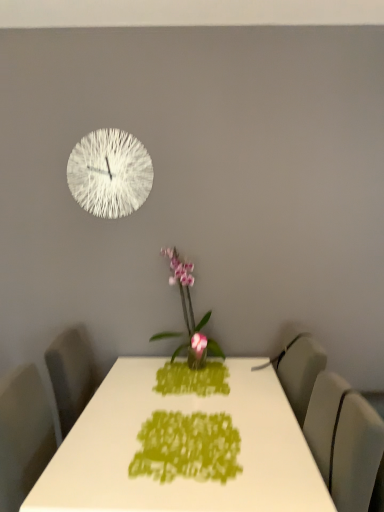
Locate an element on the screen. free space above green fabric placemat at center (from a real-world perspective) is located at coordinates (183, 440).